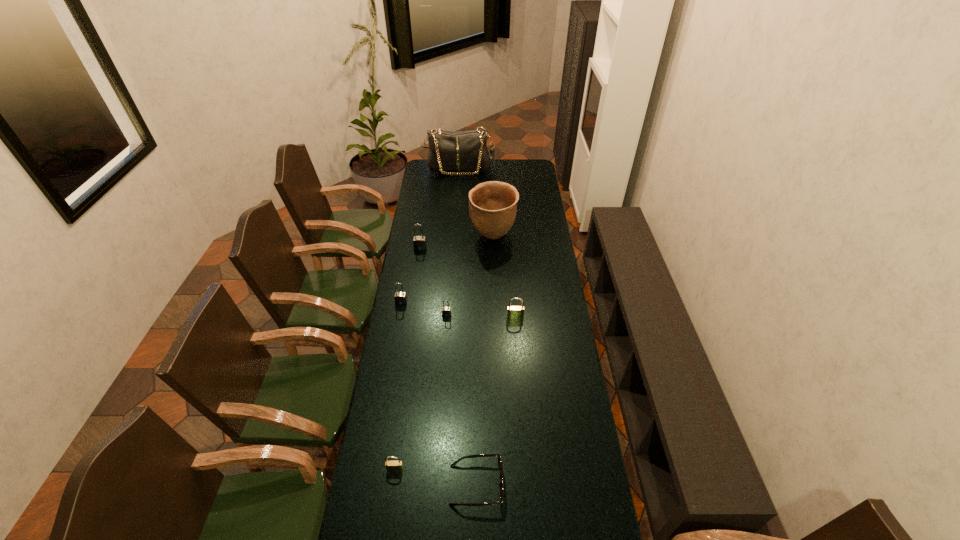
Locate an element on the screen. The height and width of the screenshot is (540, 960). free spot between the farthest object and the spectacles is located at coordinates (468, 327).

You are a GUI agent. You are given a task and a screenshot of the screen. Output one action in this format:
    pyautogui.click(x=<x>, y=<y>)
    Task: Click on the blank region between the farthest object and the fourth nearest padlock
    
    Given the screenshot: What is the action you would take?
    pyautogui.click(x=430, y=235)

Where is `free space between the pottery and the farthest gray padlock`? This screenshot has height=540, width=960. free space between the pottery and the farthest gray padlock is located at coordinates (457, 242).

Identify the location of unoccupied position between the farthest gray padlock and the right brass padlock. (468, 282).

Image resolution: width=960 pixels, height=540 pixels. I want to click on vacant point located between the fifth nearest object and the pottery, so click(447, 269).

The height and width of the screenshot is (540, 960). Identify the location of free space between the right brass padlock and the farthest gray padlock. (468, 282).

Locate an element on the screen. vacant area that lies between the second smallest gray padlock and the spectacles is located at coordinates (439, 394).

At what (x,y) coordinates should I click in order to perform the action: click on vacant space that's between the pottery and the bigger brass padlock. Please return your answer as a coordinate pair (x, y). This screenshot has width=960, height=540. Looking at the image, I should click on (504, 277).

What are the coordinates of `vacant point located between the left brass padlock and the pottery` in the screenshot? It's located at (444, 353).

Select which object is the third closest to the nearest gray padlock. Please provide its 2D coordinates. Your answer should be formatted as a tuple, i.e. [(x, y)], where the tuple contains the x and y coordinates of a point satisfying the conditions above.

[(492, 205)]